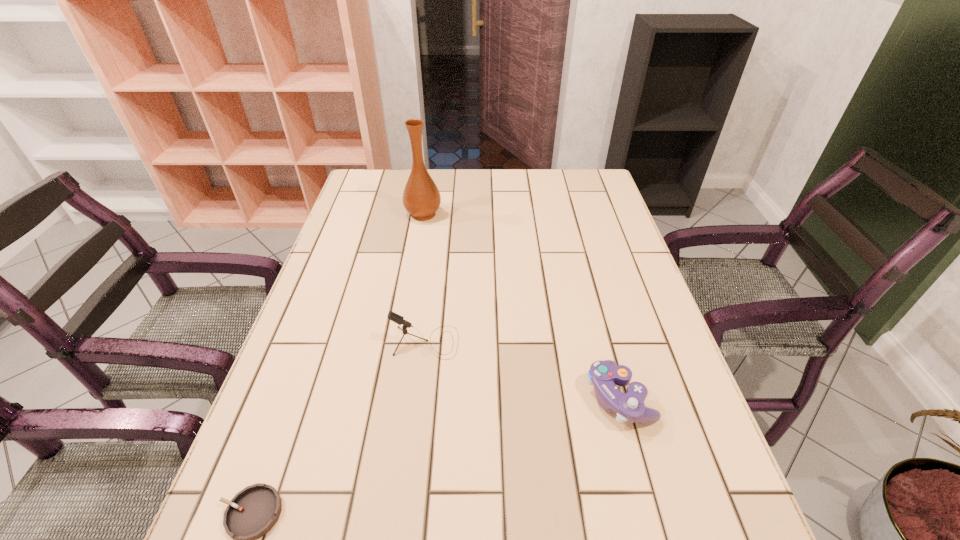
Identify the location of vase. (421, 198).

Find the location of a particular element. This screenshot has height=540, width=960. the farthest object is located at coordinates (421, 198).

Identify the location of the third nearest object. pyautogui.click(x=394, y=317).

Find the location of a particular element. the third shortest object is located at coordinates (394, 317).

At what (x,y) coordinates should I click in order to perform the action: click on the third farthest object. Please return your answer as a coordinate pair (x, y). Looking at the image, I should click on (604, 375).

Locate an element on the screen. The image size is (960, 540). control is located at coordinates pos(604,375).

Locate an element on the screen. vacant space situated 0.210m on the right of the vase is located at coordinates (510, 214).

Locate an element on the screen. The width and height of the screenshot is (960, 540). free space located on the stand of the microphone is located at coordinates (569, 342).

Image resolution: width=960 pixels, height=540 pixels. Find the location of `vacant space located 0.080m on the front of the control`. vacant space located 0.080m on the front of the control is located at coordinates (639, 475).

Find the location of `object at the far edge`. object at the far edge is located at coordinates (421, 198).